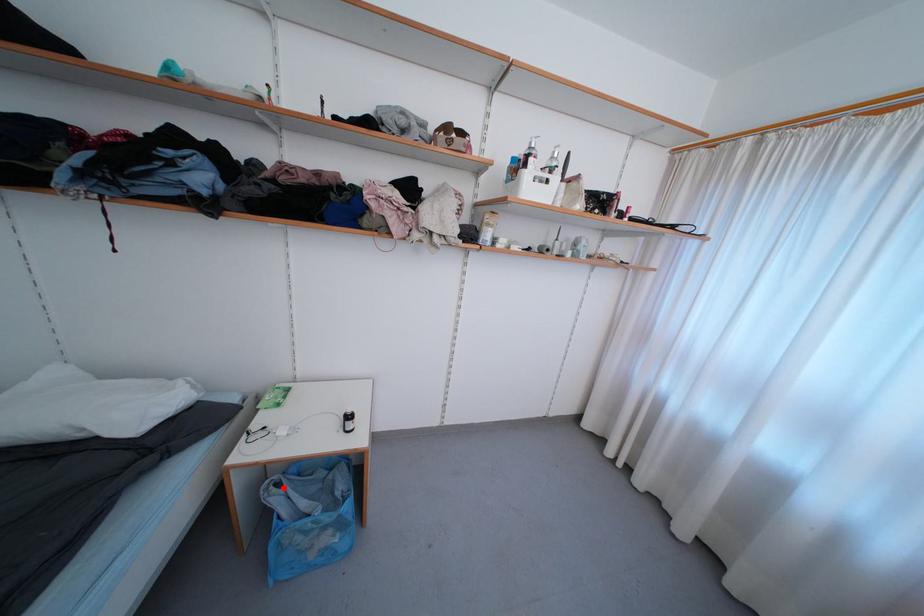
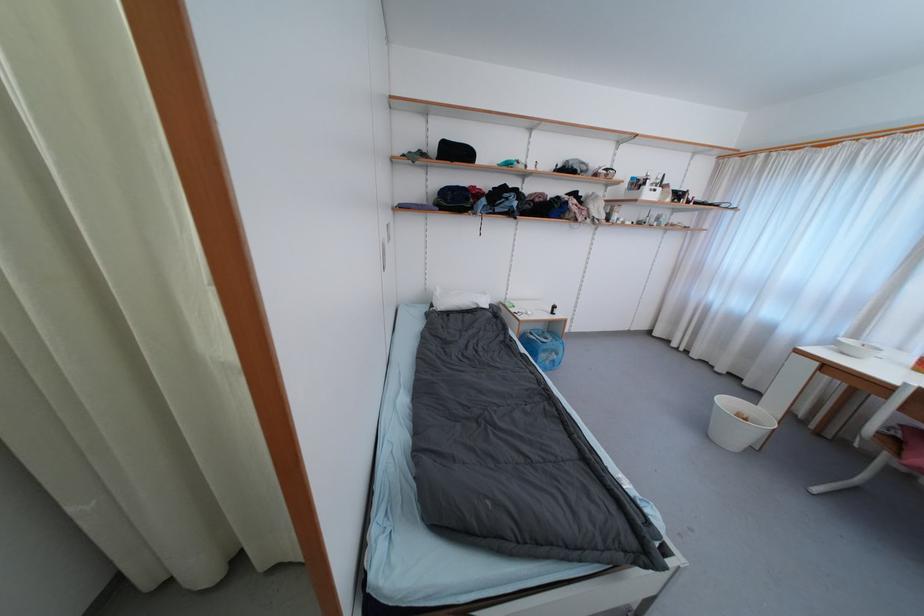
Question: I am providing you with two images of the same scene from different viewpoints. A red point is shown in image1. For the corresponding object point in image2, is it positioned nearer or farther from the camera?

Choices:
 (A) Nearer
 (B) Farther

Answer: (B)